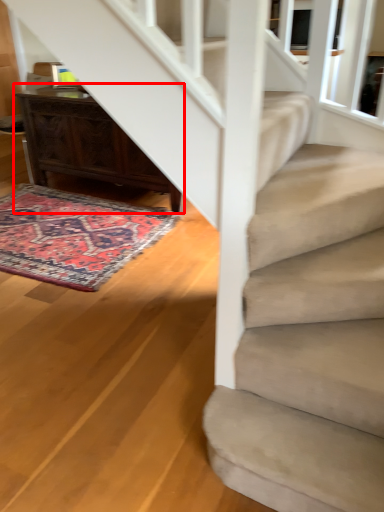
Question: From the image's perspective, considering the relative positions of desk (annotated by the red box) and mat in the image provided, where is desk (annotated by the red box) located with respect to the staircase?

Choices:
 (A) below
 (B) above

Answer: (B)